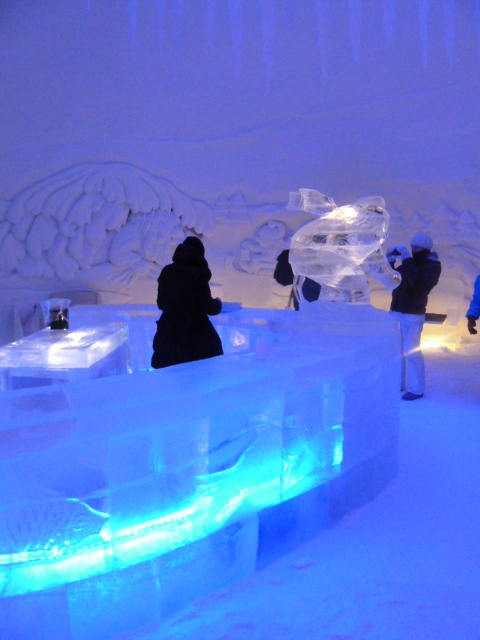
Where is `wall`? This screenshot has height=640, width=480. wall is located at coordinates (341, 157).